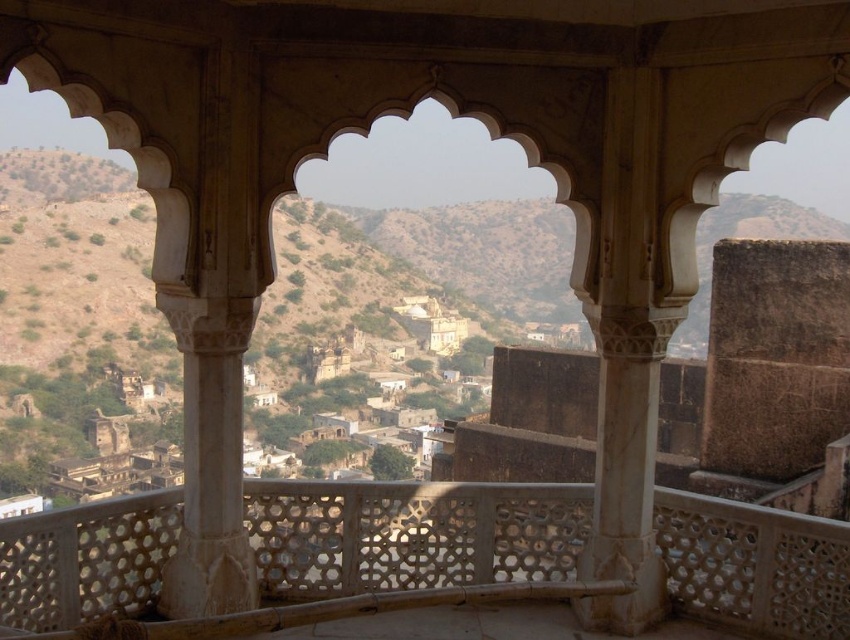
You are standing on the white marble pillar at center and want to step onto the white carved stone balcony at center. Is the balcony directly beneath you?

The white carved stone balcony at center is located below the white marble pillar at center, so yes, the balcony is directly beneath you.

You are an architect designing a new balcony that needs to be as spacious as the white marble pillar at center. Can the white carved stone balcony at center be used as a reference for the design? Please explain.

The white carved stone balcony at center occupies less space than the white marble pillar at center. Therefore, it cannot be used as a reference for a balcony design that requires the same or greater space as the white marble pillar at center.